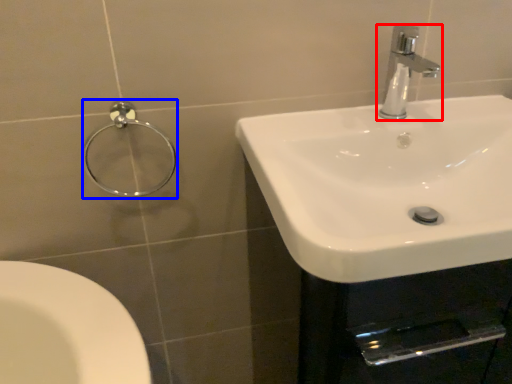
Question: Which object is further to the camera taking this photo, tap (highlighted by a red box) or shower (highlighted by a blue box)?

Choices:
 (A) tap
 (B) shower

Answer: (B)